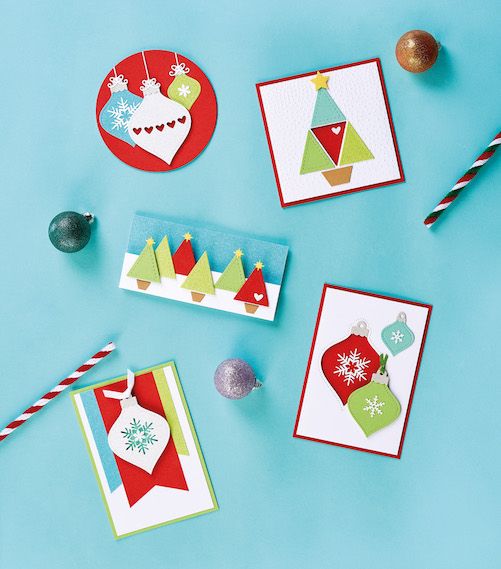
This screenshot has width=501, height=569. I want to click on frame, so click(181, 389).